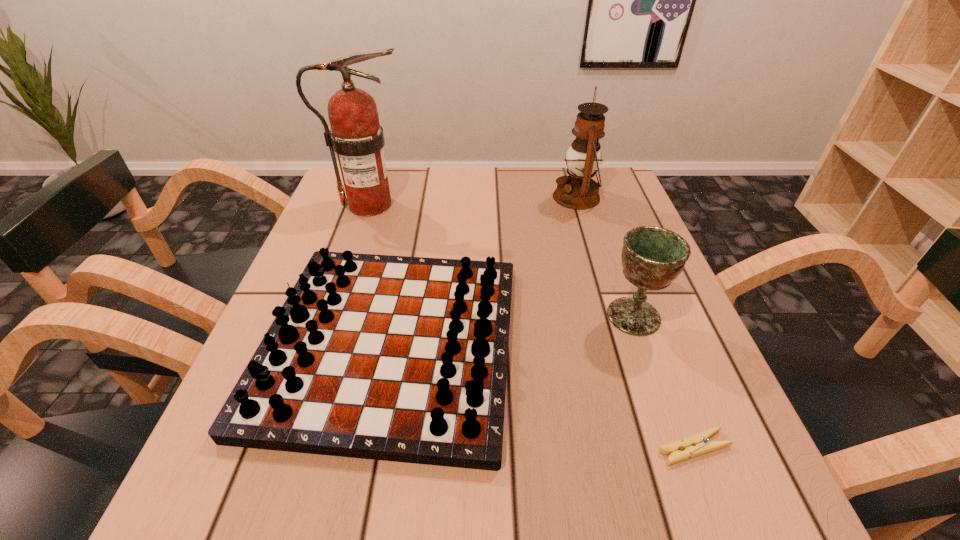
The width and height of the screenshot is (960, 540). In order to click on vacant area that satisfies the following two spatial constraints: 1. on the side of the shortest object, there is a wick adjustment knob; 2. on the right side of the lantern in this screenshot , I will do 652,448.

I want to click on free region that satisfies the following two spatial constraints: 1. on the side of the second tallest object, there is a wick adjustment knob; 2. on the right side of the shortest object, so click(652, 448).

Locate an element on the screen. This screenshot has width=960, height=540. vacant region that satisfies the following two spatial constraints: 1. on the front side of the third tallest object; 2. on the left side of the clothespin is located at coordinates (680, 448).

Locate an element on the screen. The height and width of the screenshot is (540, 960). vacant space that satisfies the following two spatial constraints: 1. on the back side of the chalice; 2. at the nozzle of the tallest object is located at coordinates (594, 205).

Locate an element on the screen. vacant space that satisfies the following two spatial constraints: 1. on the back side of the third tallest object; 2. on the left side of the chessboard is located at coordinates (396, 316).

This screenshot has width=960, height=540. I want to click on free space in the image that satisfies the following two spatial constraints: 1. on the front side of the chessboard; 2. on the right side of the shortest object, so click(370, 448).

Locate an element on the screen. This screenshot has height=540, width=960. vacant region that satisfies the following two spatial constraints: 1. at the nozzle of the tallest object; 2. on the right side of the chessboard is located at coordinates (323, 343).

I want to click on free space that satisfies the following two spatial constraints: 1. at the nozzle of the chessboard; 2. on the right side of the fire extinguisher, so click(x=323, y=343).